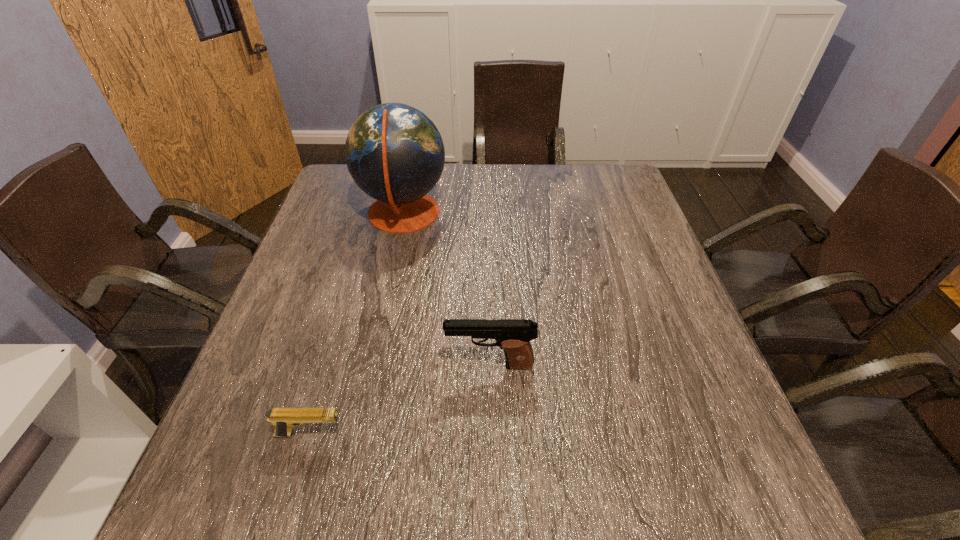
Find the location of a particular element. This screenshot has width=960, height=540. vacant area between the rightmost object and the tallest object is located at coordinates (446, 289).

In order to click on empty space that is in between the second tallest object and the nearest object in this screenshot , I will do `click(400, 400)`.

You are a GUI agent. You are given a task and a screenshot of the screen. Output one action in this format:
    pyautogui.click(x=<x>, y=<y>)
    Task: Click on the free space between the farthest object and the second farthest object
    The height and width of the screenshot is (540, 960).
    Given the screenshot: What is the action you would take?
    pyautogui.click(x=446, y=289)

Image resolution: width=960 pixels, height=540 pixels. In order to click on free space that is in between the nearer pistol and the taller pistol in this screenshot , I will do `click(400, 400)`.

I want to click on unoccupied position between the shorter pistol and the second tallest object, so click(400, 400).

Identify the location of free area in between the shorter pistol and the rightmost object. (400, 400).

At what (x,y) coordinates should I click in order to perform the action: click on free space between the nearer pistol and the taller pistol. Please return your answer as a coordinate pair (x, y). This screenshot has width=960, height=540. Looking at the image, I should click on (400, 400).

In order to click on vacant area that lies between the shorter pistol and the farthest object in this screenshot , I will do `click(357, 324)`.

Locate an element on the screen. blank region between the nearer pistol and the farther pistol is located at coordinates (400, 400).

Where is `free space that is in between the tallest object and the left pistol`? Image resolution: width=960 pixels, height=540 pixels. free space that is in between the tallest object and the left pistol is located at coordinates (357, 324).